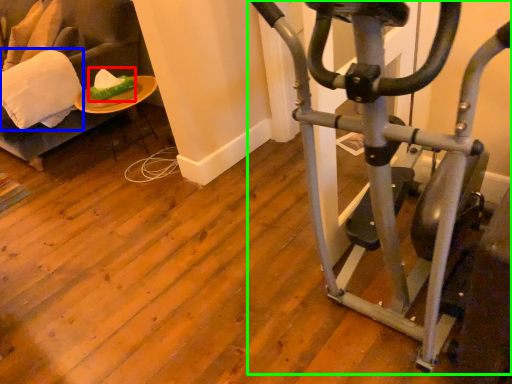
Question: Considering the real-world distances, which object is farthest from food (highlighted by a red box)? pillow (highlighted by a blue box) or stationary bicycle (highlighted by a green box)?

Choices:
 (A) pillow
 (B) stationary bicycle

Answer: (B)